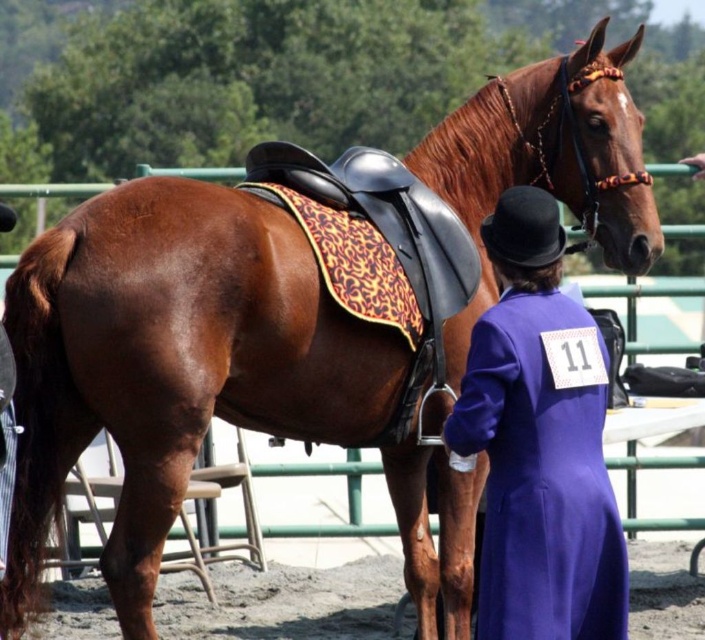
Between purple wool coat at center and dirt field at lower center, which one appears on the left side from the viewer's perspective?

dirt field at lower center is more to the left.

Is purple wool coat at center further to camera compared to dirt field at lower center?

No, purple wool coat at center is in front of dirt field at lower center.

The image size is (705, 640). I want to click on purple wool coat at center, so click(539, 442).